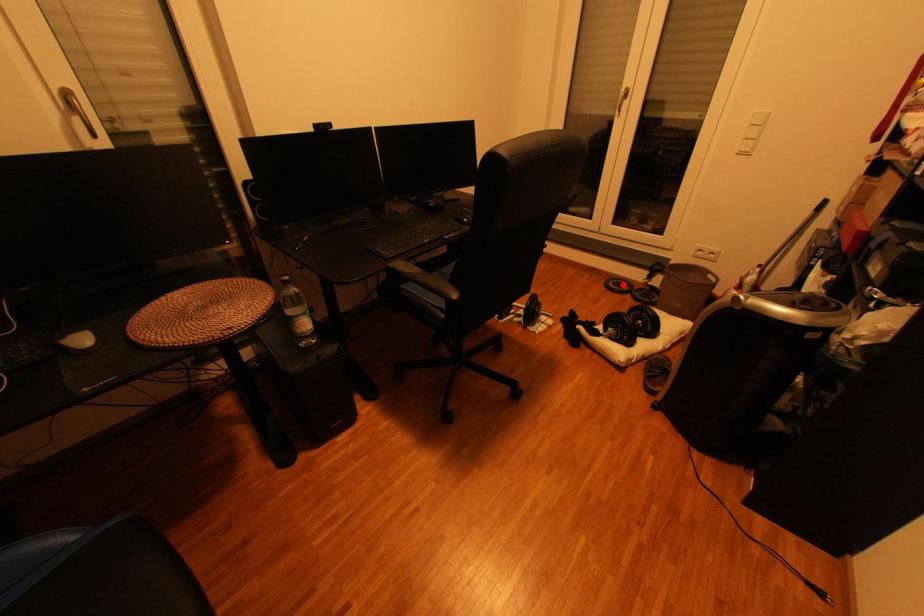
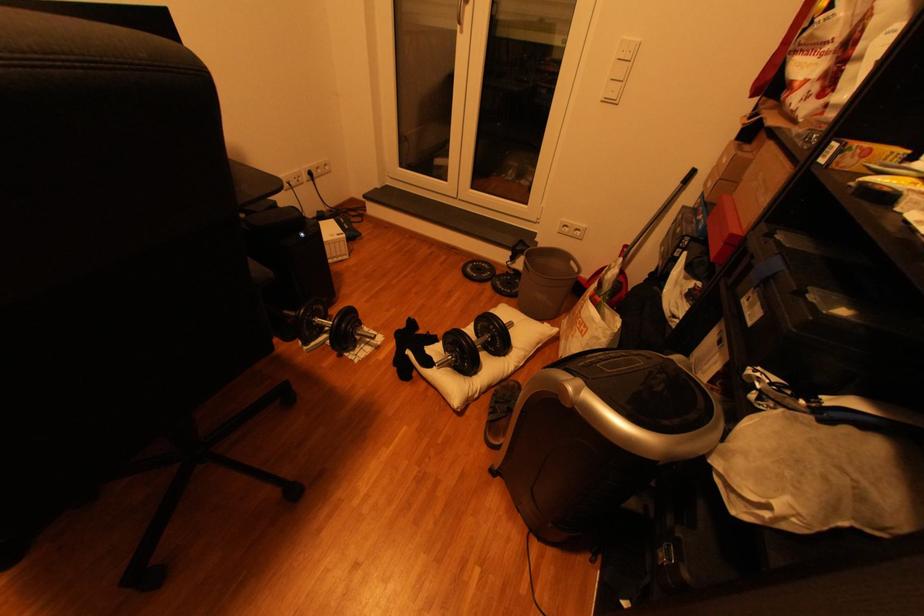
Find the pixel in the second image that matches the highlighted location in the first image.

(482, 270)